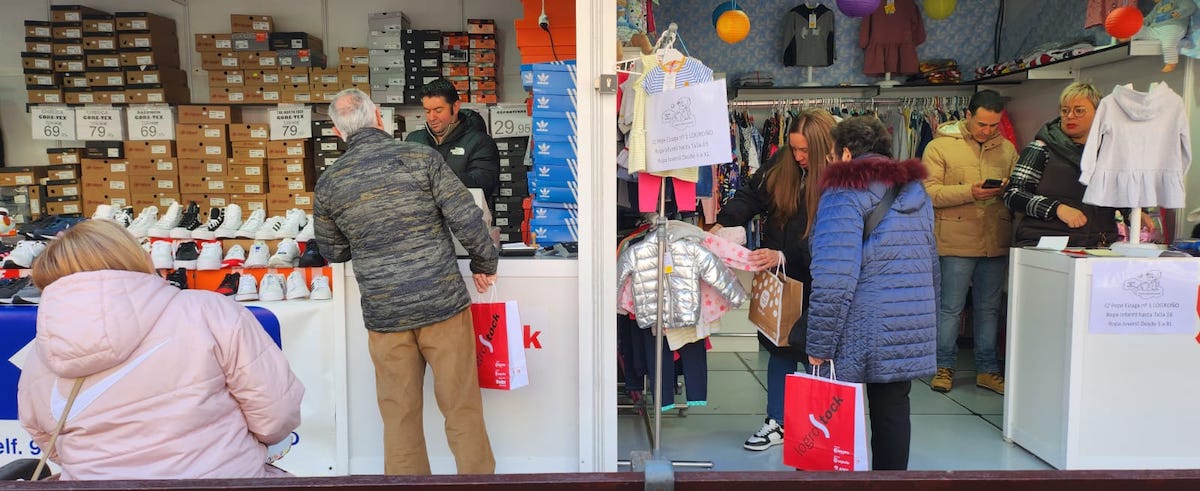
Find the location of a particular element. coat rack is located at coordinates (676, 318).